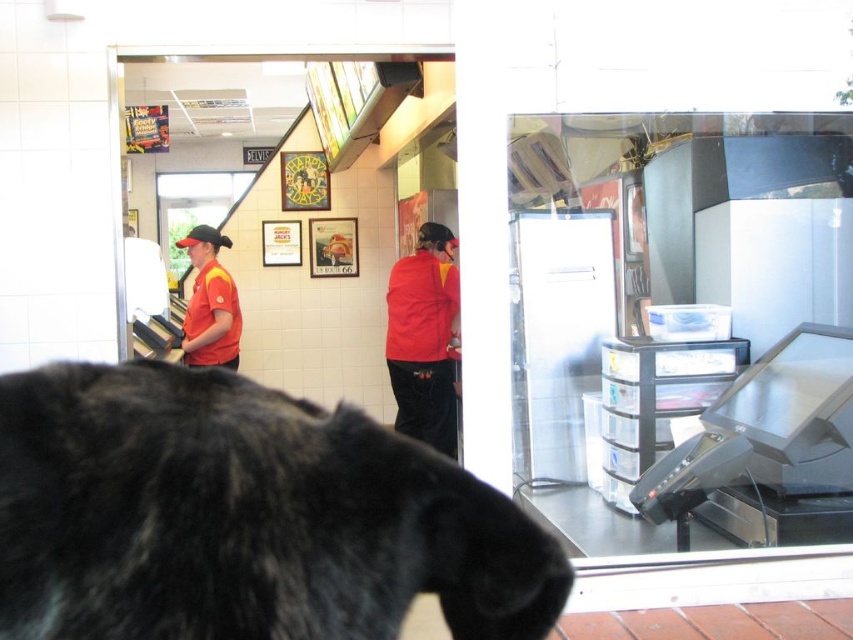
Question: Observing the image, what is the correct spatial positioning of transparent plastic drawer at center in reference to red matte uniform at center?

Choices:
 (A) right
 (B) left

Answer: (A)

Question: Which object is farther from the camera taking this photo?

Choices:
 (A) black fur dog at center
 (B) red matte uniform at center
 (C) matte red shirt at left
 (D) transparent plastic drawer at center

Answer: (B)

Question: Does transparent plastic drawer at center appear over transparent plastic screen door at center?

Choices:
 (A) no
 (B) yes

Answer: (B)

Question: Which of the following is the farthest from the observer?

Choices:
 (A) (677, 144)
 (B) (201, 296)

Answer: (B)

Question: Is black fur dog at center positioned in front of red matte uniform at center?

Choices:
 (A) yes
 (B) no

Answer: (A)

Question: Which object is farther from the camera taking this photo?

Choices:
 (A) transparent plastic drawer at center
 (B) matte red shirt at left
 (C) black fur dog at center
 (D) red matte uniform at center

Answer: (D)